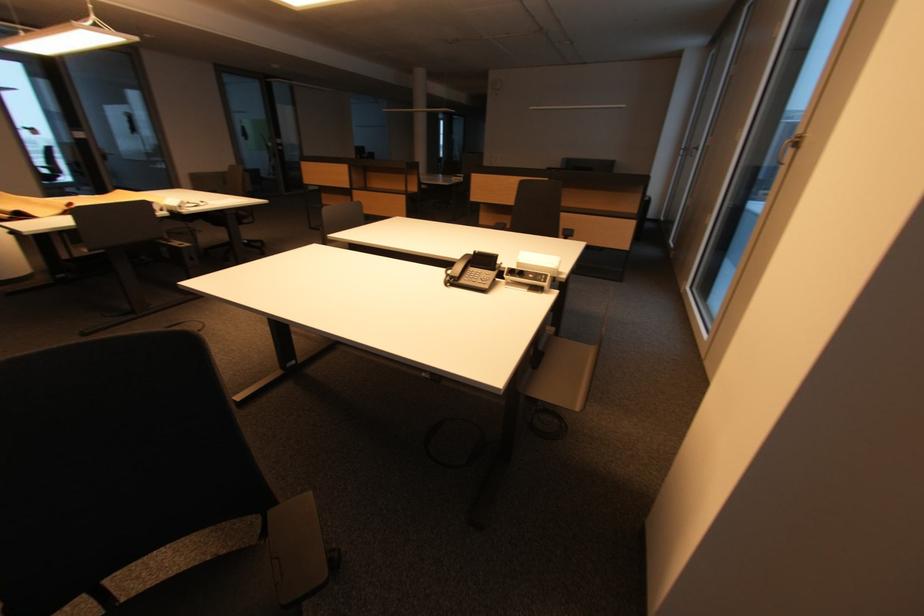
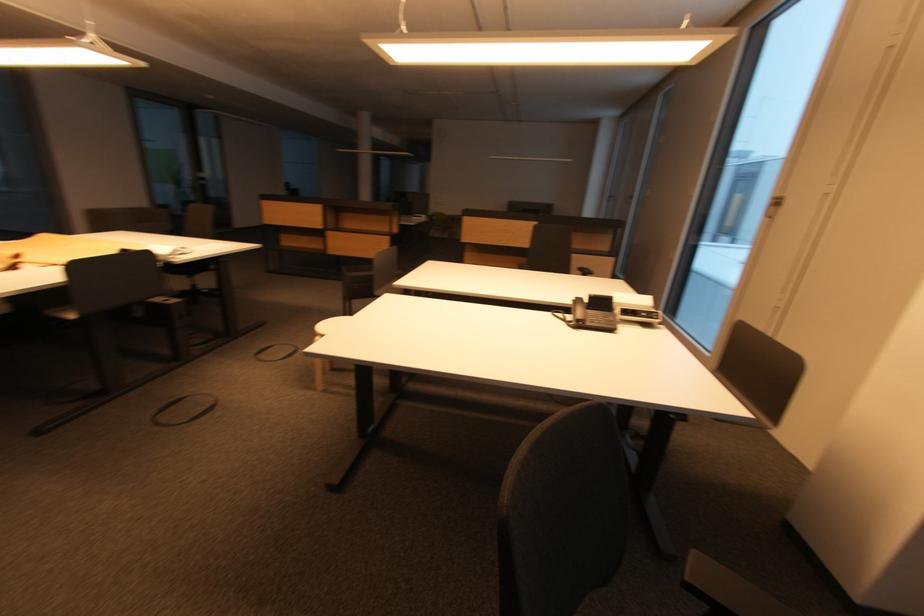
Question: The images are taken continuously from a first-person perspective. In which direction are you moving?

Choices:
 (A) Left
 (B) Right
 (C) Forward
 (D) Backward

Answer: (A)